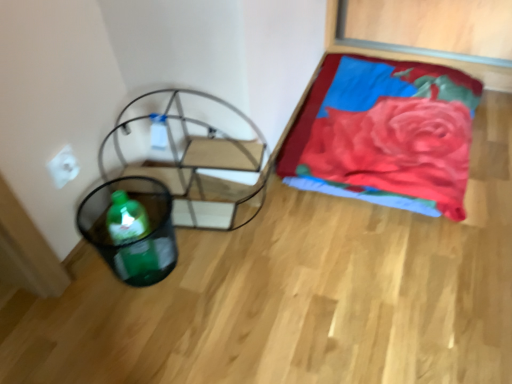
Question: Does white matte electric outlet at upper left have a lesser height compared to metallic frame swivel chair at left?

Choices:
 (A) no
 (B) yes

Answer: (B)

Question: Does white matte electric outlet at upper left have a smaller size compared to metallic frame swivel chair at left?

Choices:
 (A) yes
 (B) no

Answer: (A)

Question: Is white matte electric outlet at upper left positioned behind metallic frame swivel chair at left?

Choices:
 (A) yes
 (B) no

Answer: (A)

Question: From a real-world perspective, is white matte electric outlet at upper left over metallic frame swivel chair at left?

Choices:
 (A) no
 (B) yes

Answer: (B)

Question: Considering the relative positions of white matte electric outlet at upper left and metallic frame swivel chair at left in the image provided, is white matte electric outlet at upper left to the right of metallic frame swivel chair at left from the viewer's perspective?

Choices:
 (A) yes
 (B) no

Answer: (B)

Question: Is white matte electric outlet at upper left in front of metallic frame swivel chair at left?

Choices:
 (A) no
 (B) yes

Answer: (A)

Question: From the image's perspective, is metallic frame swivel chair at left located beneath green plastic basket at lower left?

Choices:
 (A) yes
 (B) no

Answer: (B)

Question: Considering the relative sizes of metallic frame swivel chair at left and green plastic basket at lower left in the image provided, is metallic frame swivel chair at left wider than green plastic basket at lower left?

Choices:
 (A) no
 (B) yes

Answer: (B)

Question: Is metallic frame swivel chair at left further to camera compared to green plastic basket at lower left?

Choices:
 (A) no
 (B) yes

Answer: (B)

Question: Is metallic frame swivel chair at left with green plastic basket at lower left?

Choices:
 (A) yes
 (B) no

Answer: (B)

Question: Can you confirm if metallic frame swivel chair at left is taller than green plastic basket at lower left?

Choices:
 (A) no
 (B) yes

Answer: (B)

Question: Is metallic frame swivel chair at left positioned with its back to green plastic basket at lower left?

Choices:
 (A) yes
 (B) no

Answer: (A)

Question: Considering the relative sizes of metallic frame swivel chair at left and white matte electric outlet at upper left in the image provided, is metallic frame swivel chair at left smaller than white matte electric outlet at upper left?

Choices:
 (A) no
 (B) yes

Answer: (A)